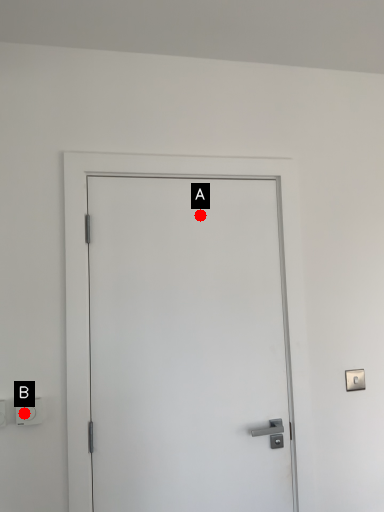
Question: Two points are circled on the image, labeled by A and B beside each circle. Which point is farther from the camera taking this photo?

Choices:
 (A) A is further
 (B) B is further

Answer: (A)